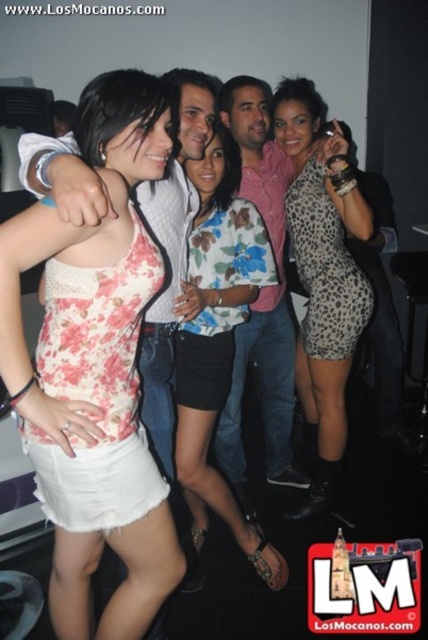
You are at a party and want to take a photo of two points in the scene. The first point is at coordinate point (281,572) and the second point is at coordinate point (294,344). Which point is closer to you?

Point (281,572) is closer to the viewer than point (294,344).

You are a photographer at the event and want to capture a closeup of the floral fabric tank top at center and the pink cotton shirt at center. Which one should you focus on to ensure it appears clearer in the photo?

The floral fabric tank top at center is closer to the viewer than the pink cotton shirt at center, so focusing on it will ensure it appears clearer in the photo.

You are a photographer standing at the back of the venue. You want to capture a clear photo of the floral fabric dress at center. What is the minimum distance you should maintain from the dress to ensure it is in focus?

The minimum distance you should maintain from the floral fabric dress at center is 1.63 meters to ensure it is in focus.